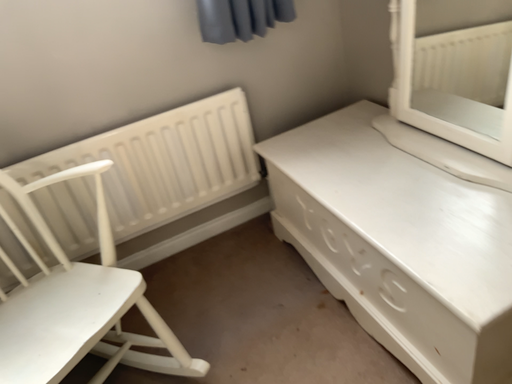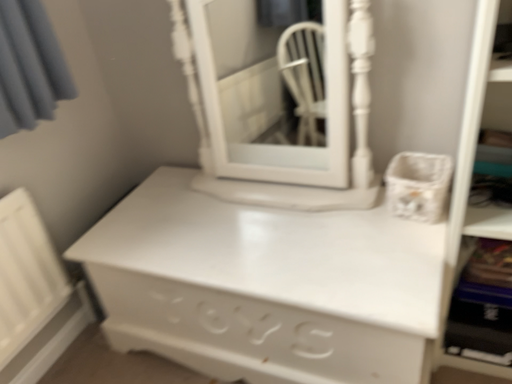
Question: Which way did the camera rotate in the video?

Choices:
 (A) rotated downward
 (B) rotated upward

Answer: (B)